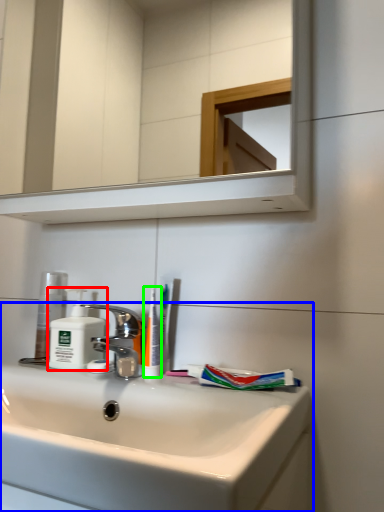
Question: Which is nearer to the soap dispenser (highlighted by a red box)? sink (highlighted by a blue box) or toothbrush (highlighted by a green box).

Choices:
 (A) sink
 (B) toothbrush

Answer: (B)